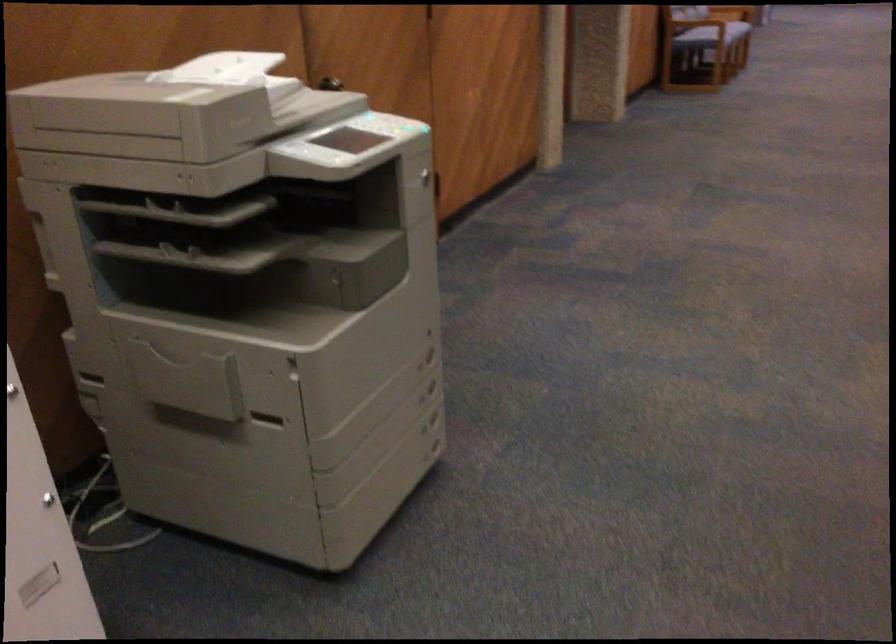
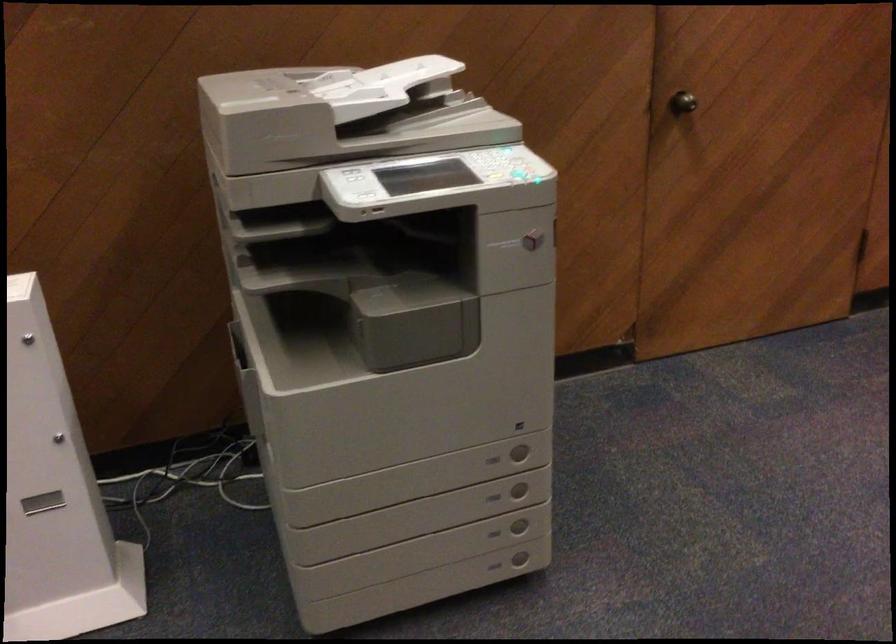
In the second image, find the point that corresponds to pixel 432 464 in the first image.

(494, 567)